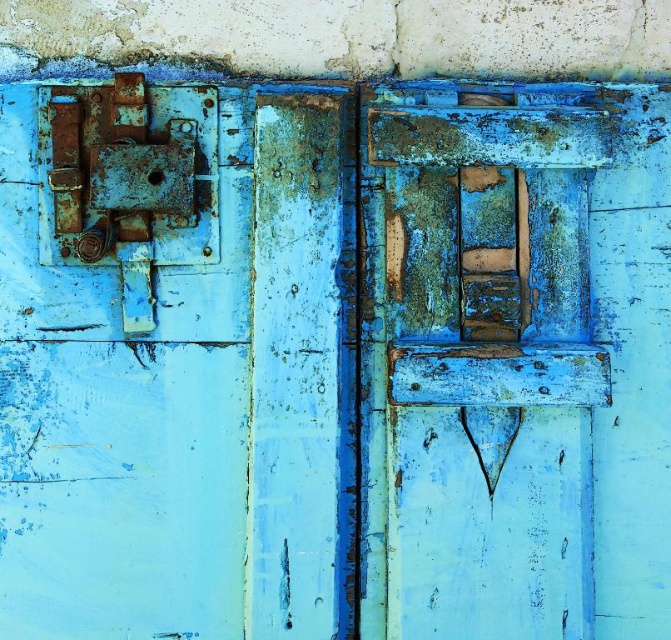
Based on the photo, does rusty metal lock at left appear on the left side of rusty wood door at center?

Indeed, rusty metal lock at left is positioned on the left side of rusty wood door at center.

Measure the distance between point (219, 552) and camera.

The distance of point (219, 552) from camera is 1.57 meters.

Where is `rusty metal lock at left`? rusty metal lock at left is located at coordinates (123, 358).